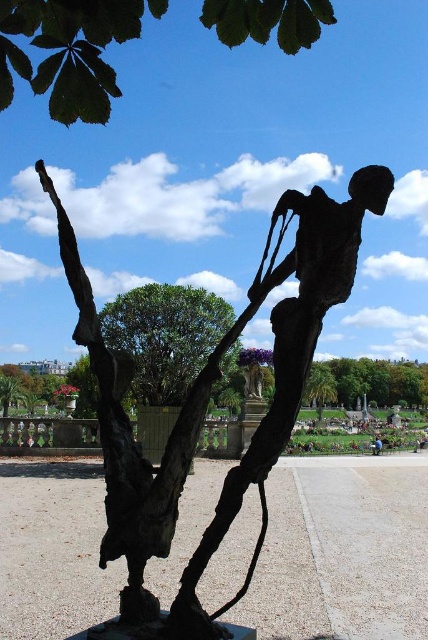
Can you confirm if green leafy tree at upper center is bigger than blue fabric person at center?

Correct, green leafy tree at upper center is larger in size than blue fabric person at center.

Which is more to the left, green leafy tree at upper center or blue fabric person at center?

Positioned to the left is green leafy tree at upper center.

This screenshot has height=640, width=428. What do you see at coordinates (68, 51) in the screenshot? I see `green leafy tree at upper center` at bounding box center [68, 51].

This screenshot has width=428, height=640. I want to click on green leafy tree at upper center, so click(68, 51).

Who is more distant from viewer, (243, 484) or (372, 444)?

Point (372, 444)

What do you see at coordinates (210, 394) in the screenshot? The height and width of the screenshot is (640, 428). I see `bronze sculpture at center` at bounding box center [210, 394].

Does point (184, 582) lie in front of point (376, 454)?

That is True.

I want to click on bronze sculpture at center, so click(x=210, y=394).

Is bronze sculpture at center smaller than green leafy tree at upper center?

Incorrect, bronze sculpture at center is not smaller in size than green leafy tree at upper center.

Consider the image. Who is shorter, bronze sculpture at center or green leafy tree at upper center?

green leafy tree at upper center

Is point (122, 534) farther from camera compared to point (253, 3)?

No.

I want to click on bronze sculpture at center, so click(x=210, y=394).